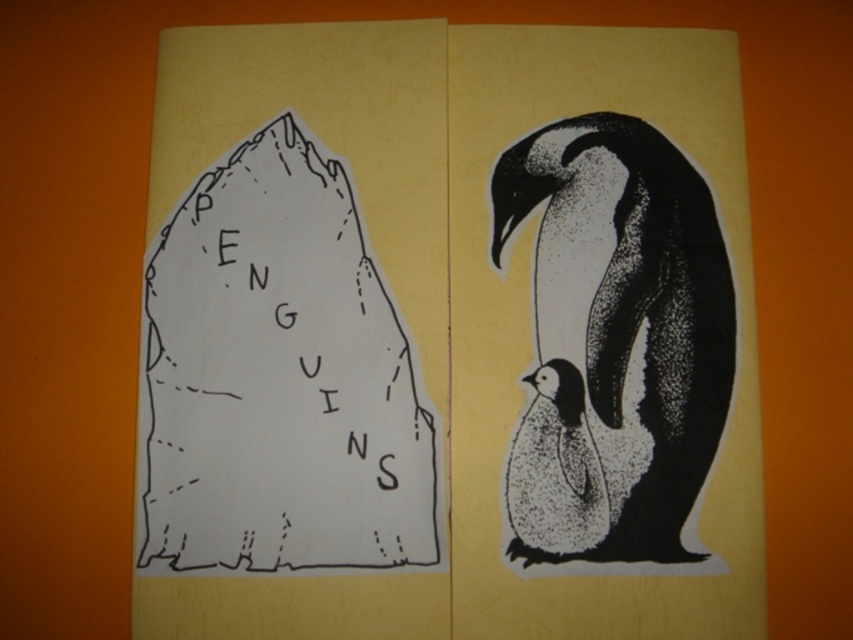
You are a bird watcher trying to observe both the black dotted penguin at right and the speckled white penguin at lower right. If your binoculars have a maximum viewing range of 4 inches, can you see both penguins clearly at the same time?

The distance between the black dotted penguin at right and the speckled white penguin at lower right is 3.74 inches, which is within the 4 inch maximum viewing range of your binoculars. Therefore, you can see both penguins clearly at the same time.

Consider the image. You have a ruler that is 12 inches long. You want to measure the distance between the white paper at center and the black dotted penguin at right. Will your ruler be long enough to measure this distance?

The distance between the white paper at center and the black dotted penguin at right is 11.30 inches. Since the ruler is 12 inches long, it is long enough to measure the distance between them.

You are an explorer trying to navigate between two points in the image. The first point is at coordinate point(310,561) and the second is at point(593,189). Which point is closer to you?

Point(310,561) is in front of point(593,189), so it is closer to you.